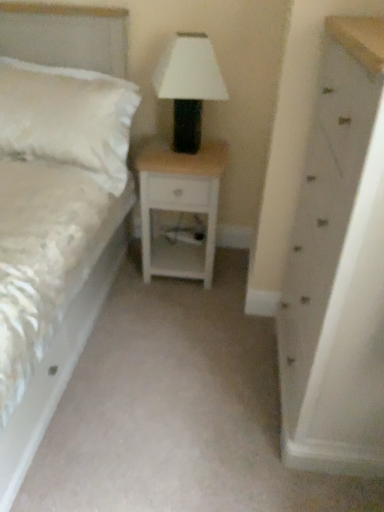
Locate an element on the screen. The width and height of the screenshot is (384, 512). vacant area that lies between white wood nightstand at center and white painted wood chest of drawers at right is located at coordinates (223, 334).